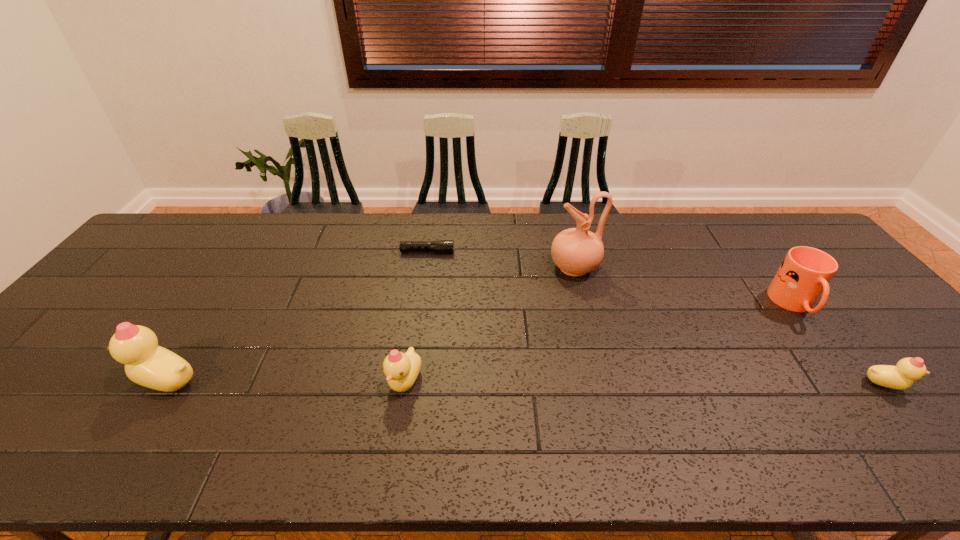
Identify which duckling is located as the nearest to the second duckling from left to right. Please provide its 2D coordinates. Your answer should be formatted as a tuple, i.e. [(x, y)], where the tuple contains the x and y coordinates of a point satisfying the conditions above.

[(147, 364)]

Identify the location of duckling that can be found as the closest to the flashlight. (402, 369).

The width and height of the screenshot is (960, 540). In order to click on free space in the image that satisfies the following two spatial constraints: 1. at the lens end of the shortest object; 2. on the front-facing side of the second shortest duckling in this screenshot , I will do `click(408, 381)`.

Where is `vacant space that satisfies the following two spatial constraints: 1. on the spout of the pottery; 2. on the front-facing side of the second tallest duckling`? The width and height of the screenshot is (960, 540). vacant space that satisfies the following two spatial constraints: 1. on the spout of the pottery; 2. on the front-facing side of the second tallest duckling is located at coordinates (603, 381).